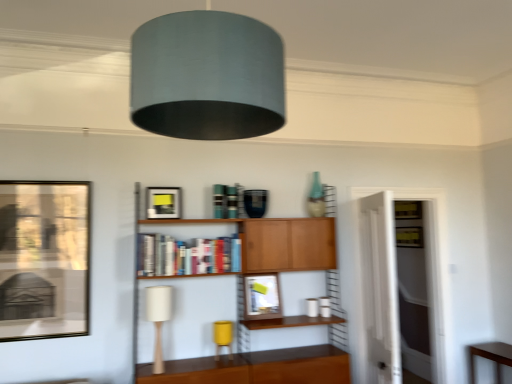
Question: Can you see matte glass picture frame at center, which is the 3th picture frame in front-to-back order, touching wooden cabinet at center?

Choices:
 (A) yes
 (B) no

Answer: (B)

Question: Considering the relative positions of matte glass picture frame at center, placed as the first picture frame when sorted from right to left, and wooden cabinet at center in the image provided, is matte glass picture frame at center, placed as the first picture frame when sorted from right to left, in front of wooden cabinet at center?

Choices:
 (A) yes
 (B) no

Answer: (B)

Question: Does matte glass picture frame at center, which is the 1th picture frame from back to front, have a smaller size compared to wooden cabinet at center?

Choices:
 (A) yes
 (B) no

Answer: (A)

Question: Considering the relative positions of matte glass picture frame at center, which is the 3th picture frame in front-to-back order, and wooden cabinet at center in the image provided, is matte glass picture frame at center, which is the 3th picture frame in front-to-back order, to the right of wooden cabinet at center from the viewer's perspective?

Choices:
 (A) yes
 (B) no

Answer: (A)

Question: Is matte glass picture frame at center, which is the 1th picture frame from back to front, oriented away from wooden cabinet at center?

Choices:
 (A) no
 (B) yes

Answer: (A)

Question: Could you tell me if matte glass picture frame at center, which is the 3th picture frame in front-to-back order, is turned towards wooden cabinet at center?

Choices:
 (A) no
 (B) yes

Answer: (B)

Question: Can you confirm if matte black picture frame at upper center, which is counted as the second picture frame, starting from the back, is thinner than brown wooden table at lower right?

Choices:
 (A) no
 (B) yes

Answer: (B)

Question: From the image's perspective, does matte black picture frame at upper center, positioned as the 2th picture frame in front-to-back order, appear higher than brown wooden table at lower right?

Choices:
 (A) yes
 (B) no

Answer: (A)

Question: Does matte black picture frame at upper center, the 2th picture frame when ordered from left to right, have a larger size compared to brown wooden table at lower right?

Choices:
 (A) no
 (B) yes

Answer: (A)

Question: Is matte black picture frame at upper center, the 2th picture frame when ordered from left to right, outside brown wooden table at lower right?

Choices:
 (A) no
 (B) yes

Answer: (B)

Question: Is the depth of matte black picture frame at upper center, the 2th picture frame when ordered from left to right, greater than that of brown wooden table at lower right?

Choices:
 (A) yes
 (B) no

Answer: (B)

Question: Are matte black picture frame at upper center, which is counted as the second picture frame, starting from the back, and brown wooden table at lower right making contact?

Choices:
 (A) no
 (B) yes

Answer: (A)

Question: Can you confirm if white fabric table lamp at lower left, arranged as the second table lamp when viewed from the back, is smaller than matte black picture frame at left, arranged as the third picture frame when viewed from the right?

Choices:
 (A) yes
 (B) no

Answer: (A)